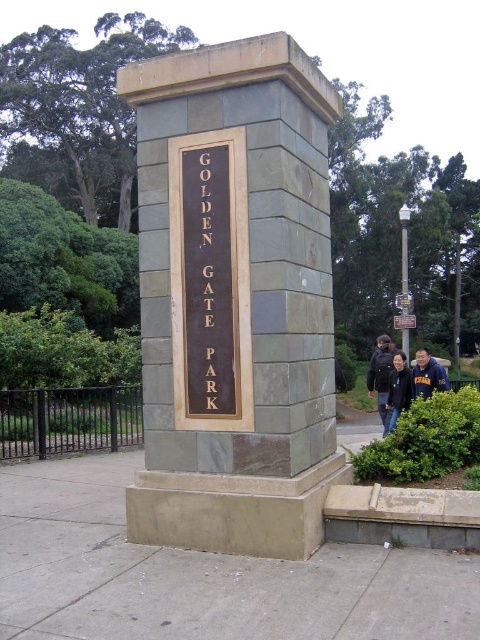
You are standing at the entrance of Golden Gate Park and see the monument with two points marked on it. Which point, point [206,250] or point [205,362], is closer to you?

Point [206,250] is closer to you because it is further to the viewer than point [205,362].